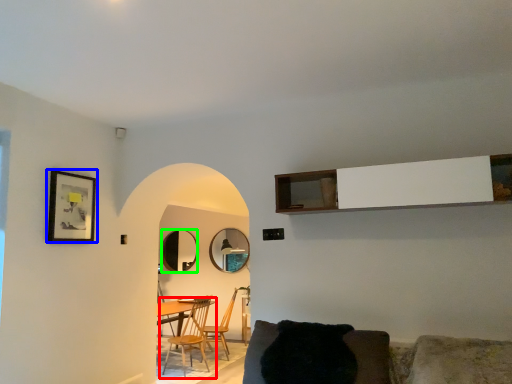
Question: Which object is positioned closest to chair (highlighted by a red box)? Select from picture frame (highlighted by a blue box) and mirror (highlighted by a green box).

Choices:
 (A) picture frame
 (B) mirror

Answer: (B)